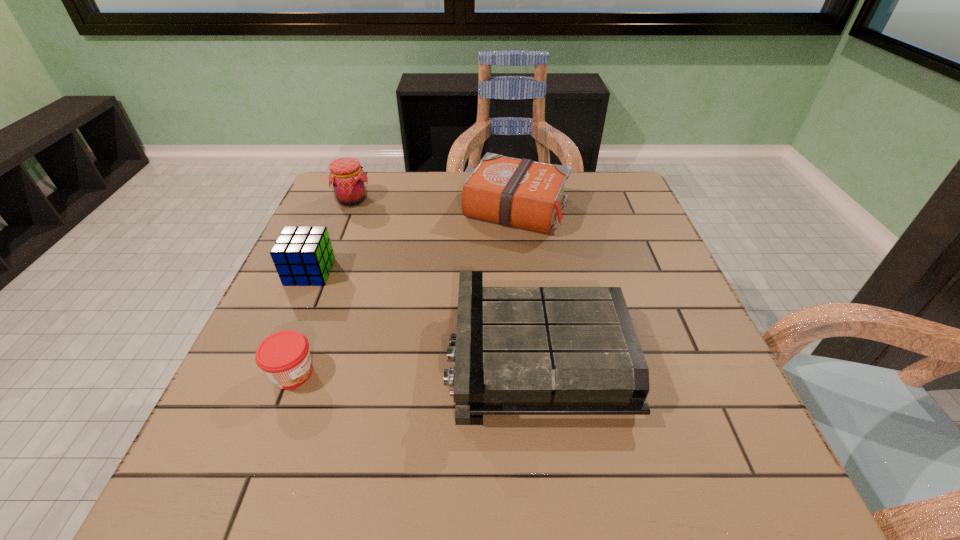
Identify the location of vacant space located on the front panel of the radio receiver. (356, 356).

At what (x,y) coordinates should I click in order to perform the action: click on vacant region located 0.100m on the front panel of the radio receiver. Please return your answer as a coordinate pair (x, y). Looking at the image, I should click on (397, 356).

Locate an element on the screen. This screenshot has width=960, height=540. free space located on the label side of the nearer jam is located at coordinates (429, 373).

Find the location of a particular element. This screenshot has width=960, height=540. jam located at the far edge is located at coordinates (347, 179).

Where is `Bible present at the far edge`? Bible present at the far edge is located at coordinates (522, 193).

Image resolution: width=960 pixels, height=540 pixels. In order to click on cube located in the left edge section of the desktop in this screenshot , I will do `click(303, 256)`.

I want to click on object at the far left corner, so pos(347,179).

Locate an element on the screen. blank space at the near edge of the desktop is located at coordinates (320, 485).

At what (x,y) coordinates should I click in order to perform the action: click on vacant region at the right edge of the desktop. Please return your answer as a coordinate pair (x, y). This screenshot has width=960, height=540. Looking at the image, I should click on (651, 354).

This screenshot has width=960, height=540. I want to click on free space at the near left corner of the desktop, so click(x=256, y=491).